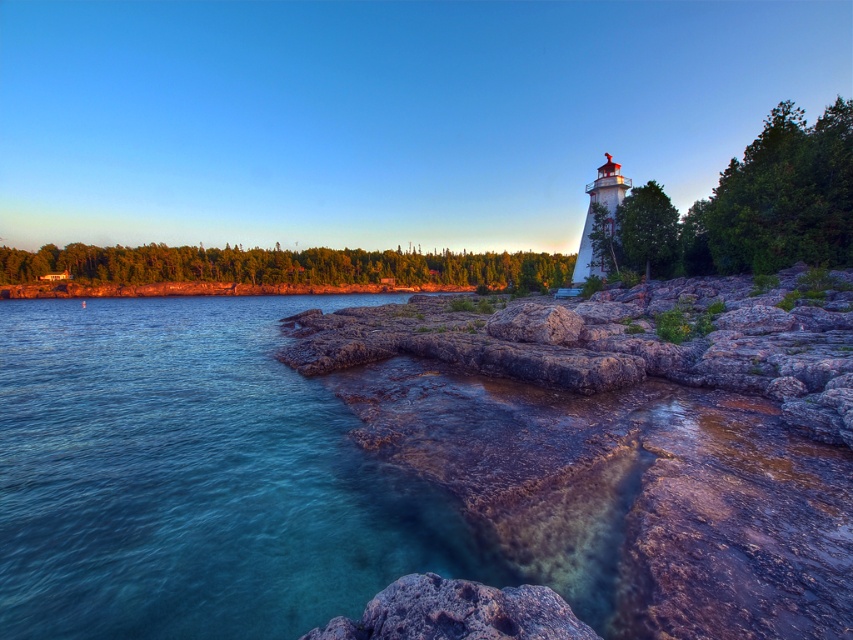
What do you see at coordinates (631, 436) in the screenshot? The height and width of the screenshot is (640, 853). I see `rockysmooth rockrocky at right` at bounding box center [631, 436].

Is rockysmooth rockrocky at right to the right of rusty rock at lower center from the viewer's perspective?

Indeed, rockysmooth rockrocky at right is positioned on the right side of rusty rock at lower center.

Between point (366, 346) and point (437, 600), which one is positioned in front?

Point (437, 600)

This screenshot has height=640, width=853. I want to click on rockysmooth rockrocky at right, so click(631, 436).

Is clear blue water at lower left thinner than rusty rock at lower center?

No, clear blue water at lower left is not thinner than rusty rock at lower center.

Who is positioned more to the right, clear blue water at lower left or rusty rock at lower center?

rusty rock at lower center is more to the right.

The width and height of the screenshot is (853, 640). Describe the element at coordinates (195, 477) in the screenshot. I see `clear blue water at lower left` at that location.

The height and width of the screenshot is (640, 853). What are the coordinates of `clear blue water at lower left` in the screenshot? It's located at (195, 477).

This screenshot has width=853, height=640. Describe the element at coordinates (631, 436) in the screenshot. I see `rockysmooth rockrocky at right` at that location.

Locate an element on the screen. rockysmooth rockrocky at right is located at coordinates (631, 436).

What do you see at coordinates (631, 436) in the screenshot? I see `rockysmooth rockrocky at right` at bounding box center [631, 436].

Find the location of a particular element. The height and width of the screenshot is (640, 853). rockysmooth rockrocky at right is located at coordinates (631, 436).